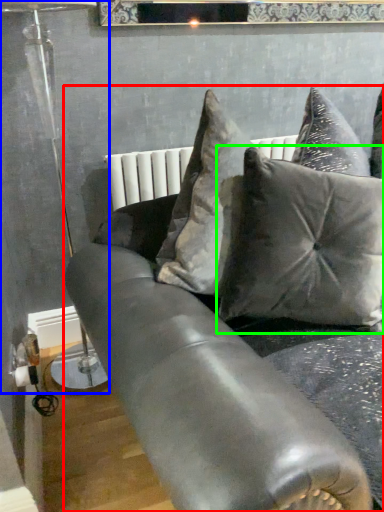
Question: Considering the real-world distances, which object is closest to studio couch (highlighted by a red box)? lamp (highlighted by a blue box) or pillow (highlighted by a green box).

Choices:
 (A) lamp
 (B) pillow

Answer: (B)